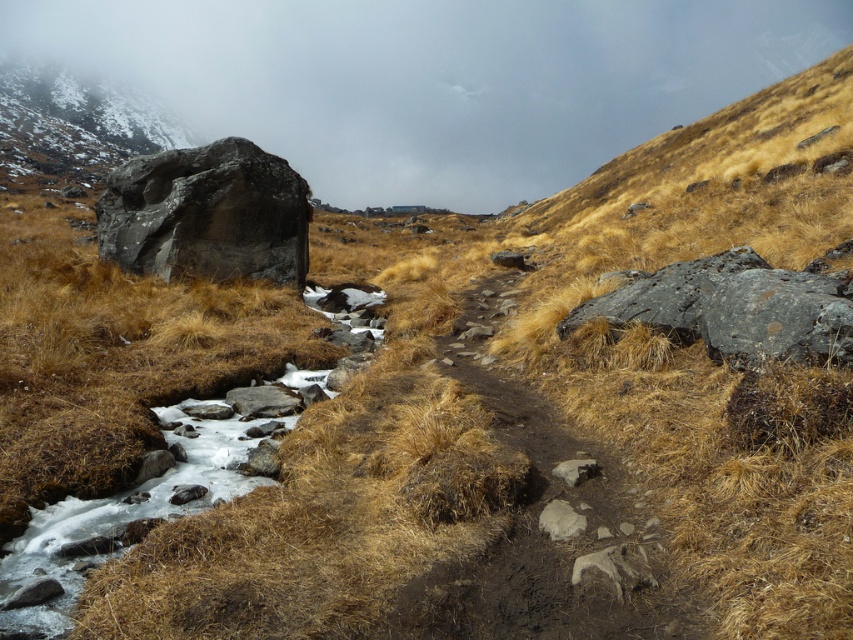
Does foggy mist at upper center appear under smooth gray rock at lower center?

Actually, foggy mist at upper center is above smooth gray rock at lower center.

The width and height of the screenshot is (853, 640). In order to click on foggy mist at upper center in this screenshot , I will do 428,80.

What are the coordinates of `foggy mist at upper center` in the screenshot? It's located at (428, 80).

Can you confirm if white ice at center is positioned to the right of smooth gray rock at lower center?

In fact, white ice at center is to the left of smooth gray rock at lower center.

Who is positioned more to the right, white ice at center or smooth gray rock at lower center?

Positioned to the right is smooth gray rock at lower center.

Who is more forward, (204, 509) or (579, 528)?

Positioned in front is point (579, 528).

Locate an element on the screen. The width and height of the screenshot is (853, 640). white ice at center is located at coordinates (126, 509).

Measure the distance between foggy mist at upper center and snowy granite boulder at upper left.

They are 65.62 meters apart.

Can you confirm if foggy mist at upper center is bigger than snowy granite boulder at upper left?

Correct, foggy mist at upper center is larger in size than snowy granite boulder at upper left.

You are a GUI agent. You are given a task and a screenshot of the screen. Output one action in this format:
    pyautogui.click(x=<x>, y=<y>)
    Task: Click on the foggy mist at upper center
    This screenshot has width=853, height=640.
    Given the screenshot: What is the action you would take?
    pyautogui.click(x=428, y=80)